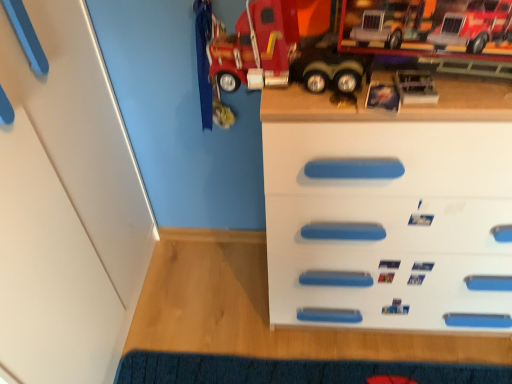
Question: In terms of height, does white plastic chest of drawers at center look taller or shorter compared to blue textured mat at lower center?

Choices:
 (A) tall
 (B) short

Answer: (A)

Question: Does point (504, 246) appear closer or farther from the camera than point (163, 367)?

Choices:
 (A) farther
 (B) closer

Answer: (B)

Question: From the image's perspective, is white plastic chest of drawers at center positioned above or below blue textured mat at lower center?

Choices:
 (A) below
 (B) above

Answer: (B)

Question: Is blue textured mat at lower center spatially inside white plastic chest of drawers at center, or outside of it?

Choices:
 (A) inside
 (B) outside

Answer: (B)

Question: Considering the positions of blue textured mat at lower center and white plastic chest of drawers at center in the image, is blue textured mat at lower center bigger or smaller than white plastic chest of drawers at center?

Choices:
 (A) big
 (B) small

Answer: (B)

Question: Considering the positions of blue textured mat at lower center and white plastic chest of drawers at center in the image, is blue textured mat at lower center wider or thinner than white plastic chest of drawers at center?

Choices:
 (A) wide
 (B) thin

Answer: (B)

Question: In the image, is blue textured mat at lower center positioned in front of or behind white plastic chest of drawers at center?

Choices:
 (A) front
 (B) behind

Answer: (B)